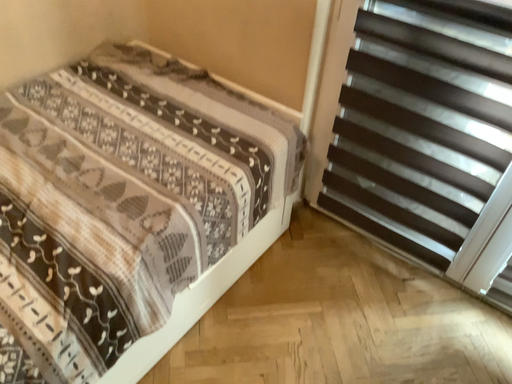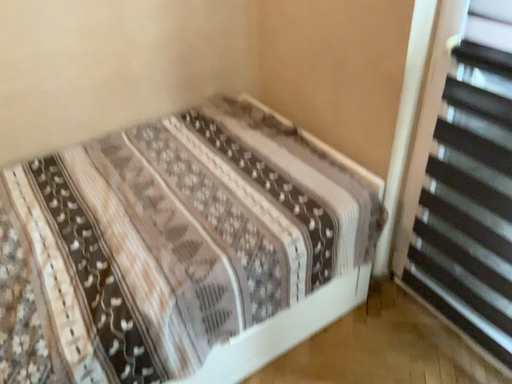
Question: Which way did the camera rotate in the video?

Choices:
 (A) rotated downward
 (B) rotated upward

Answer: (B)